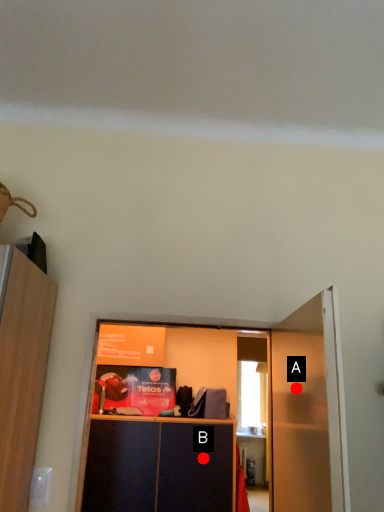
Question: Two points are circled on the image, labeled by A and B beside each circle. Which of the following is the farthest from the observer?

Choices:
 (A) A is further
 (B) B is further

Answer: (B)